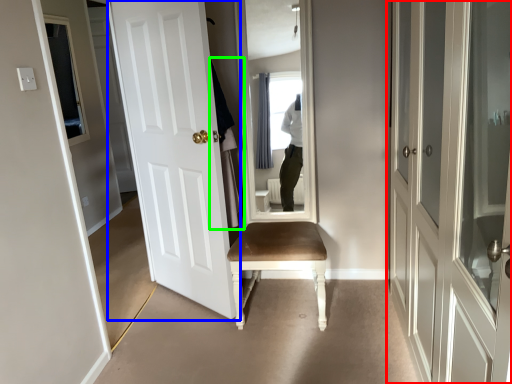
Question: Which is nearer to the door (highlighted by a red box)? door (highlighted by a blue box) or robe (highlighted by a green box).

Choices:
 (A) door
 (B) robe

Answer: (B)